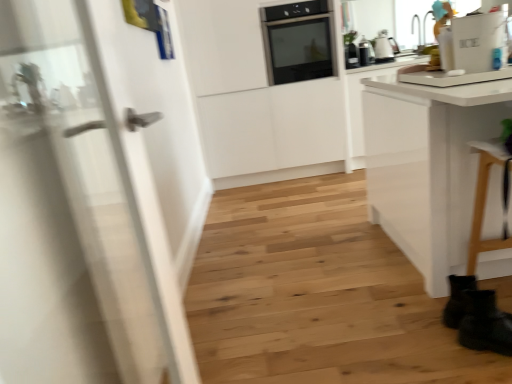
Question: From the image's perspective, relative to black matte boot at lower right, is black glossy toaster at upper right, marked as the 1th kitchen appliance in a left-to-right arrangement, above or below?

Choices:
 (A) below
 (B) above

Answer: (B)

Question: Considering the positions of black glossy toaster at upper right, marked as the 1th kitchen appliance in a left-to-right arrangement, and black matte boot at lower right in the image, is black glossy toaster at upper right, marked as the 1th kitchen appliance in a left-to-right arrangement, taller or shorter than black matte boot at lower right?

Choices:
 (A) short
 (B) tall

Answer: (A)

Question: Which of these objects is positioned farthest from the white glossy refrigerator at upper right?

Choices:
 (A) black matte boot at lower right
 (B) black glossy toaster at upper right, marked as the 1th kitchen appliance in a left-to-right arrangement
 (C) black glass oven at upper center
 (D) matte silver kettle at upper right, which appears as the 1th kitchen appliance when viewed from the right
 (E) white glossy door at left

Answer: (D)

Question: Considering the real-world distances, which object is farthest from the black glossy toaster at upper right, marked as the 1th kitchen appliance in a left-to-right arrangement?

Choices:
 (A) matte silver kettle at upper right, the second kitchen appliance when ordered from left to right
 (B) black matte boot at lower right
 (C) black glass oven at upper center
 (D) white glossy refrigerator at upper right
 (E) white glossy door at left

Answer: (E)